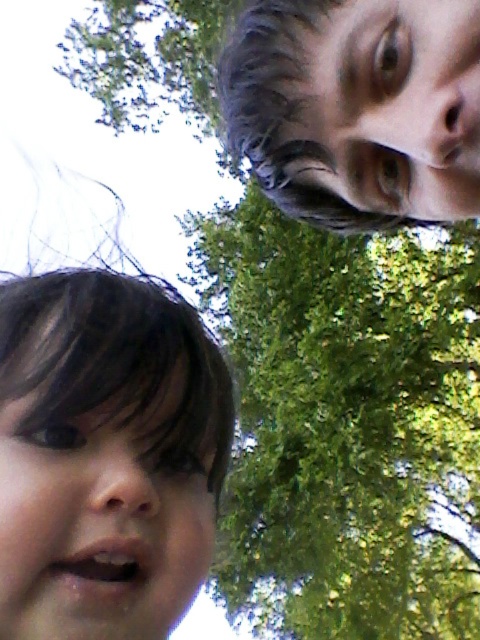
You are a photographer trying to capture a portrait of both faces in the image. Since the smooth skin face at bottom left and the smooth skin face at upper right are positioned in different areas, can you adjust your camera angle so that both faces are framed equally within the shot?

The smooth skin face at bottom left is located below the smooth skin face at upper right. To frame both equally, adjust the camera angle to include both the lower and upper positions of the faces.

You are a photographer trying to capture a group photo of the smooth skin face at bottom left and the other person in the image. The minimum distance required for your camera to focus properly is 12 inches. Based on the scene, will the camera be able to focus on both subjects?

The smooth skin face at bottom left and the other person are 12.02 inches apart. Since the minimum focusing distance is 12 inches, the camera can just barely focus on both subjects as the distance is slightly above the threshold.